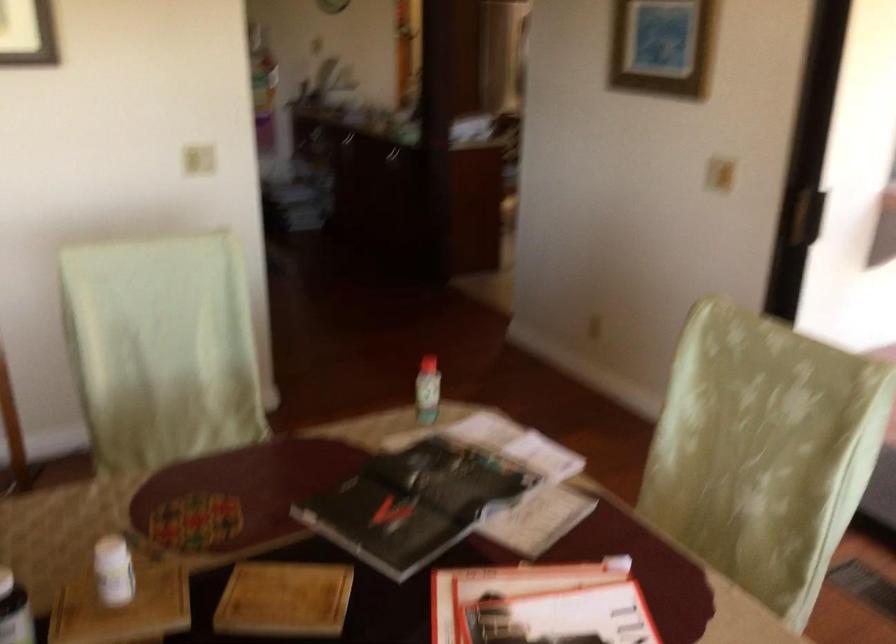
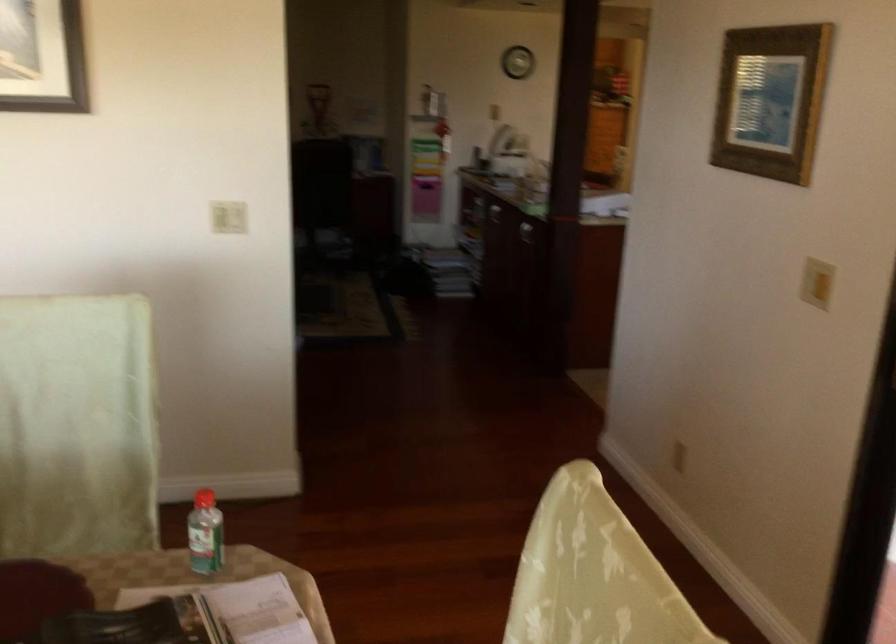
Locate, in the second image, the point that corresponds to pixel 196 152 in the first image.

(228, 216)